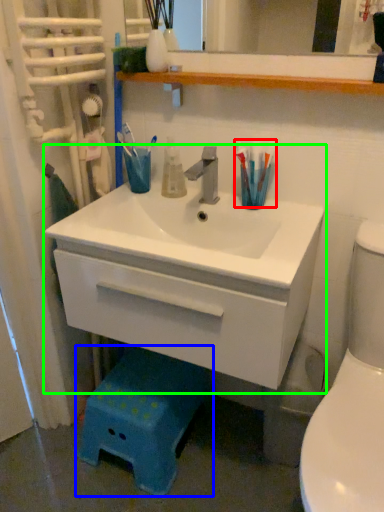
Question: Which is farther away from toothbrush (highlighted by a red box)? step stool (highlighted by a blue box) or bathroom cabinet (highlighted by a green box)?

Choices:
 (A) step stool
 (B) bathroom cabinet

Answer: (A)